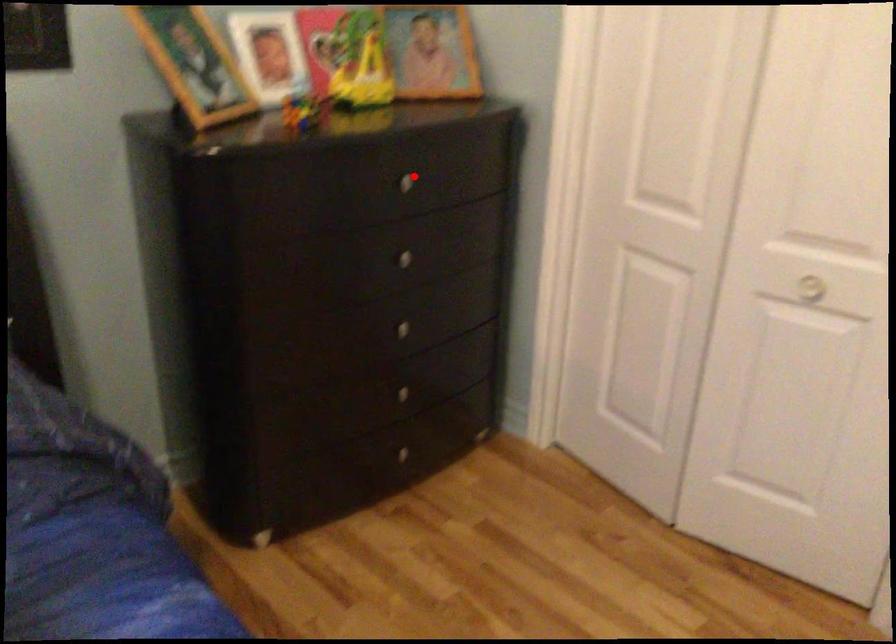
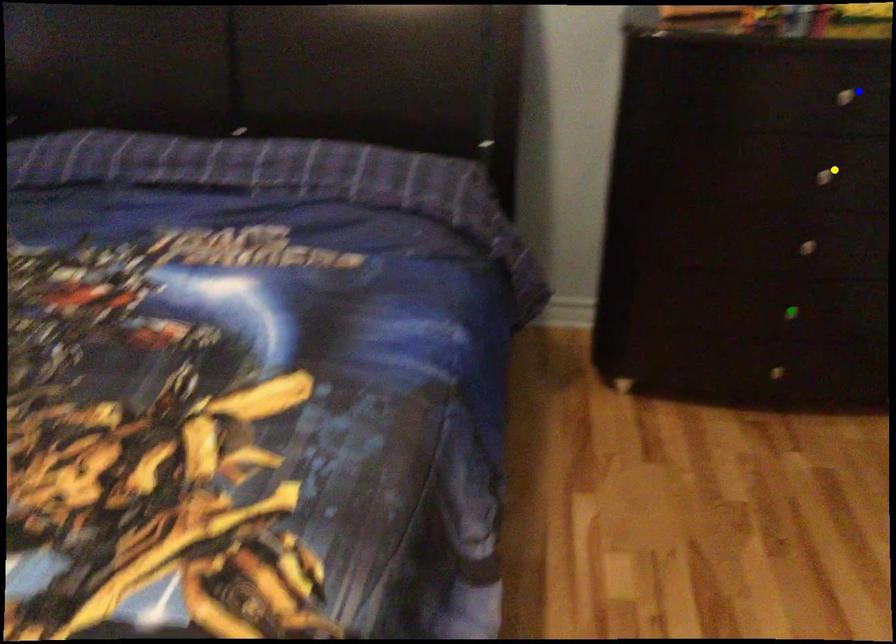
Question: I am providing you with two images of the same scene from different viewpoints. A red point is marked on the first image. You are given multiple points on the second image. Which spot in image 2 lines up with the point in image 1?

Choices:
 (A) blue point
 (B) yellow point
 (C) green point

Answer: (A)